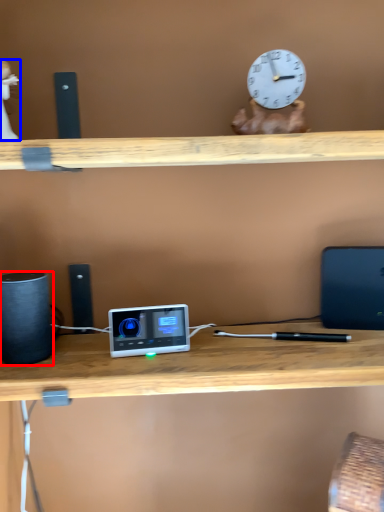
Question: Which object appears closest to the camera in this image, speaker (highlighted by a red box) or toy (highlighted by a blue box)?

Choices:
 (A) speaker
 (B) toy

Answer: (B)